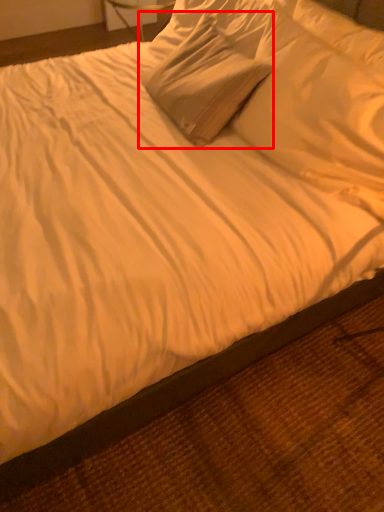
Question: From the image's perspective, considering the relative positions of pillow (annotated by the red box) and pillow in the image provided, where is pillow (annotated by the red box) located with respect to the staircase?

Choices:
 (A) below
 (B) above

Answer: (B)